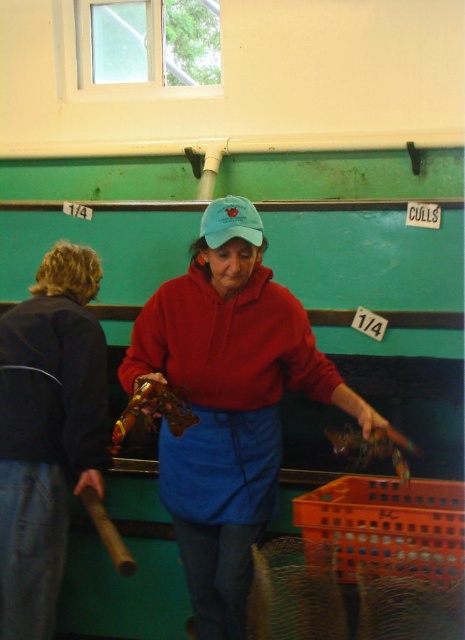
You are a worker in a seafood processing plant and need to reach a tool placed exactly between the matte red sweatshirt at center and the blue cotton cap at center. If your arm can extend 18 inches, can you reach the tool without moving either item?

The matte red sweatshirt at center is 17.76 inches away from the blue cotton cap at center. Since your arm can extend 18 inches, you can reach the tool placed between them without moving either item.

You are standing in the room and see the matte red sweatshirt at center and the dark blue denim jacket at left. Which one is positioned more to the right side of the room?

The matte red sweatshirt at center is positioned more to the right side of the room than the dark blue denim jacket at left.

You are standing in the scene and need to locate the dark blue denim jacket at left. Where exactly should you look?

The dark blue denim jacket at left is located at point 0.675 on the x axis and 0.103 on the y axis.